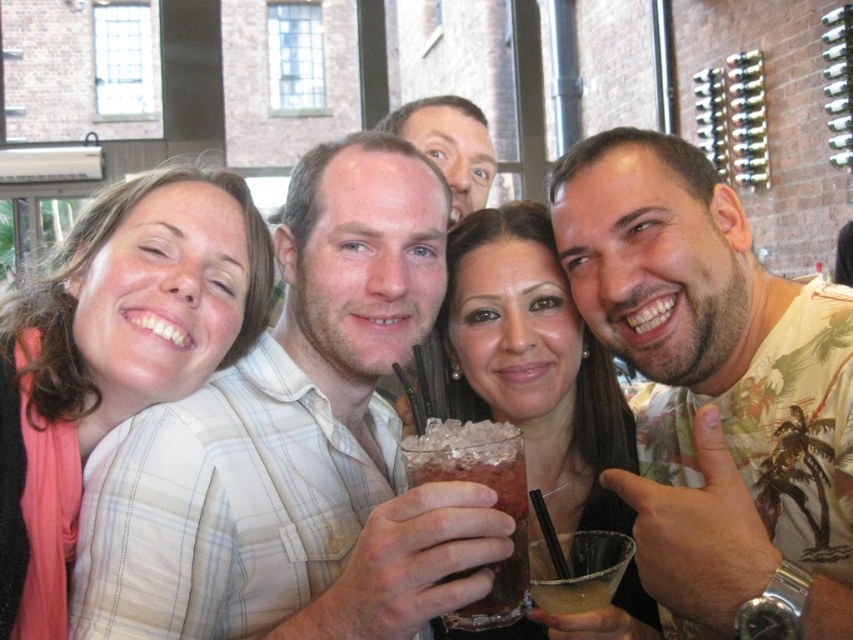
You are a photographer standing in front of the group. You want to take a photo that includes both the matte beige shirt at left and the clear glass drink at center. Which object should you focus on first to ensure both are in focus?

You should focus on the matte beige shirt at left first because it is closer to you than the clear glass drink at center. By focusing on the closer object, the depth of field will naturally include the farther object in focus as well.

Based on the photo, you are standing in front of the group of people at the social gathering. You notice two points marked in the image. Which point, point (117, 372) or point (523, 572), is closer to you?

Point (117, 372) is closer to you because it is further to the viewer than point (523, 572).

You are a photographer at the event and want to capture a photo of the clear glass drink at center without any obstructions. Since the smooth skin face at upper center is in the way, where should you position yourself to avoid it?

The clear glass drink at center is positioned under the smooth skin face at upper center, so you should position yourself below the smooth skin face at upper center to capture the clear glass drink at center without obstruction.